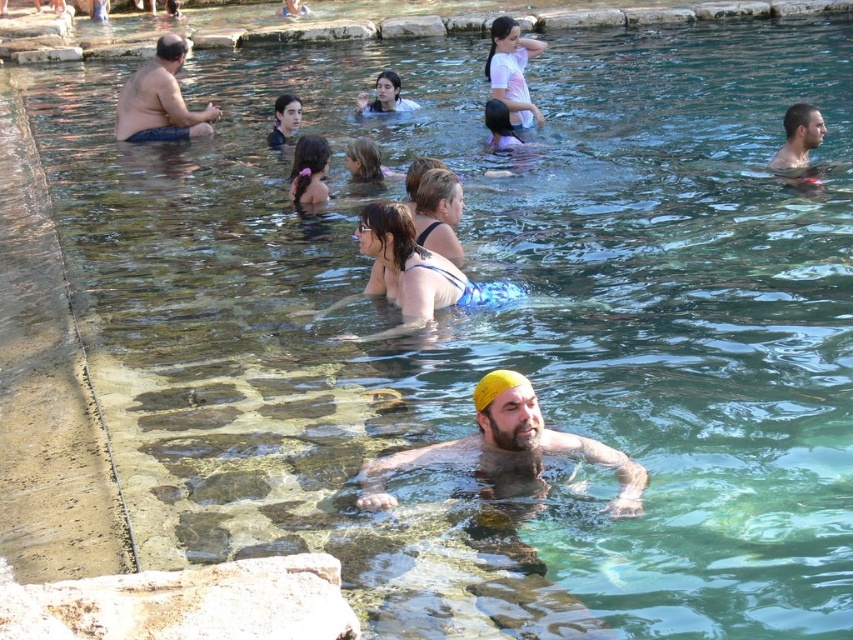
You are a photographer planning to take a group photo of the yellow rubber cap at center and the matte skin man at left. Since you want to include both subjects in the frame, which one should you focus on to ensure both are visible?

The yellow rubber cap at center occupies less space than the matte skin man at left, so you should focus on the matte skin man at left to ensure both are visible in the frame.

You are a photographer taking pictures of the yellow rubber cap at center and the matte skin man at left. Which object is positioned lower in the image?

The yellow rubber cap at center is positioned lower than the matte skin man at left in the image.